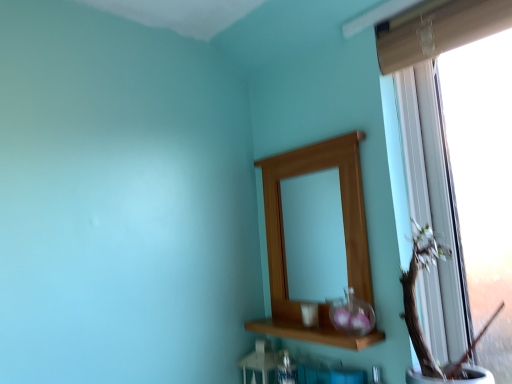
Measure the distance between wooden shelf at center and camera.

The depth of wooden shelf at center is 3.35 feet.

In order to face wooden mirror at upper center, should I rotate leftwards or rightwards?

Turn right by 7.092 degrees to look at wooden mirror at upper center.

At what (x,y) coordinates should I click in order to perform the action: click on transparent glass vase at center. Please return your answer as a coordinate pair (x, y). Image resolution: width=512 pixels, height=384 pixels. Looking at the image, I should click on (352, 314).

What's the angular difference between transparent glass vase at center and wooden vase at right's facing directions?

There is a 0.576-degree angle between the facing directions of transparent glass vase at center and wooden vase at right.

Visually, is transparent glass vase at center positioned to the left or to the right of wooden vase at right?

Based on their positions, transparent glass vase at center is located to the left of wooden vase at right.

From a real-world perspective, which object stands above the other?

wooden vase at right is physically above.

Does point (360, 322) come farther from viewer compared to point (413, 338)?

Yes, point (360, 322) is farther from viewer.

In the image, is wooden mirror at upper center on the left side or the right side of wooden vase at right?

From the image, it's evident that wooden mirror at upper center is to the left of wooden vase at right.

From the image's perspective, is wooden mirror at upper center positioned above or below wooden vase at right?

wooden mirror at upper center is situated higher than wooden vase at right in the image.

Is wooden mirror at upper center taller than wooden vase at right?

Yes.

Who is taller, wooden shelf at center or transparent glass vase at center?

With more height is transparent glass vase at center.

From a real-world perspective, is wooden shelf at center beneath transparent glass vase at center?

Yes, from a real-world perspective, wooden shelf at center is below transparent glass vase at center.

Is wooden shelf at center positioned beyond the bounds of transparent glass vase at center?

wooden shelf at center is positioned outside transparent glass vase at center.

Is point (431, 247) in front of point (314, 341)?

That is True.

From the image's perspective, is wooden vase at right beneath wooden shelf at center?

No, from the image's perspective, wooden vase at right is not below wooden shelf at center.

Is wooden vase at right closer to the viewer compared to wooden shelf at center?

Yes, it is in front of wooden shelf at center.

I want to click on window sill on the left of wooden vase at right, so click(313, 332).

What's the angular difference between wooden vase at right and wooden mirror at upper center's facing directions?

There is a 0.809-degree angle between the facing directions of wooden vase at right and wooden mirror at upper center.

Considering the positions of points (406, 304) and (362, 274), is point (406, 304) farther from camera compared to point (362, 274)?

No, (406, 304) is closer to viewer.

Considering the sizes of objects wooden vase at right and wooden mirror at upper center in the image provided, who is taller, wooden vase at right or wooden mirror at upper center?

With more height is wooden mirror at upper center.

This screenshot has width=512, height=384. Identify the location of medicine cabinet behind the wooden vase at right. (344, 235).

In the image, is wooden mirror at upper center positioned in front of or behind transparent glass vase at center?

wooden mirror at upper center is positioned farther from the viewer than transparent glass vase at center.

Considering the relative sizes of wooden mirror at upper center and transparent glass vase at center in the image provided, is wooden mirror at upper center thinner than transparent glass vase at center?

Correct, the width of wooden mirror at upper center is less than that of transparent glass vase at center.

Which is more to the right, wooden mirror at upper center or transparent glass vase at center?

Positioned to the right is transparent glass vase at center.

At what (x,y) coordinates should I click in order to perform the action: click on medicine cabinet located above the transparent glass vase at center (from a real-world perspective). Please return your answer as a coordinate pair (x, y). Looking at the image, I should click on (344, 235).

From the image's perspective, is wooden vase at right located above or below transparent glass vase at center?

wooden vase at right is situated higher than transparent glass vase at center in the image.

Identify the location of glass vase that is below the wooden vase at right (from the image's perspective). (352, 314).

Considering the positions of objects wooden vase at right and transparent glass vase at center in the image provided, who is in front, wooden vase at right or transparent glass vase at center?

wooden vase at right is closer to the camera.

From a real-world perspective, is wooden vase at right positioned under transparent glass vase at center based on gravity?

No.

I want to click on floral arrangement located in front of the transparent glass vase at center, so click(x=416, y=306).

In order to click on floral arrangement directly beneath the wooden mirror at upper center (from a real-world perspective) in this screenshot , I will do `click(416, 306)`.

In the scene shown: Looking at the image, which one is located closer to wooden mirror at upper center, wooden vase at right or wooden shelf at center?

wooden shelf at center.

Which object lies nearer to the anchor point wooden mirror at upper center, wooden vase at right or transparent glass vase at center?

transparent glass vase at center is closer to wooden mirror at upper center.

When comparing their distances from wooden shelf at center, does wooden mirror at upper center or transparent glass vase at center seem further?

Among the two, wooden mirror at upper center is located further to wooden shelf at center.

When comparing their distances from wooden shelf at center, does wooden mirror at upper center or wooden vase at right seem closer?

wooden mirror at upper center is positioned closer to the anchor wooden shelf at center.

Which object lies nearer to the anchor point transparent glass vase at center, wooden shelf at center or wooden mirror at upper center?

wooden shelf at center is positioned closer to the anchor transparent glass vase at center.

Which object lies further to the anchor point wooden vase at right, wooden shelf at center or wooden mirror at upper center?

wooden mirror at upper center.

Estimate the real-world distances between objects in this image. Which object is closer to transparent glass vase at center, wooden mirror at upper center or wooden shelf at center?

wooden shelf at center is closer to transparent glass vase at center.

Looking at the image, which one is located further to transparent glass vase at center, wooden vase at right or wooden mirror at upper center?

Based on the image, wooden mirror at upper center appears to be further to transparent glass vase at center.

This screenshot has height=384, width=512. In order to click on window sill located between wooden vase at right and transparent glass vase at center in the depth direction in this screenshot , I will do `click(313, 332)`.

Locate an element on the screen. This screenshot has height=384, width=512. medicine cabinet between wooden shelf at center and wooden vase at right from left to right is located at coordinates (344, 235).

This screenshot has width=512, height=384. I want to click on glass vase located between wooden vase at right and wooden mirror at upper center in the depth direction, so click(352, 314).

This screenshot has height=384, width=512. I want to click on glass vase between wooden mirror at upper center and wooden shelf at center vertically, so [352, 314].